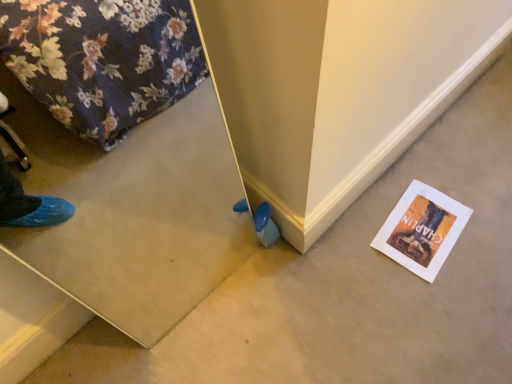
What are the coordinates of `vacant space that is to the left of white paper at lower right` in the screenshot? It's located at (349, 249).